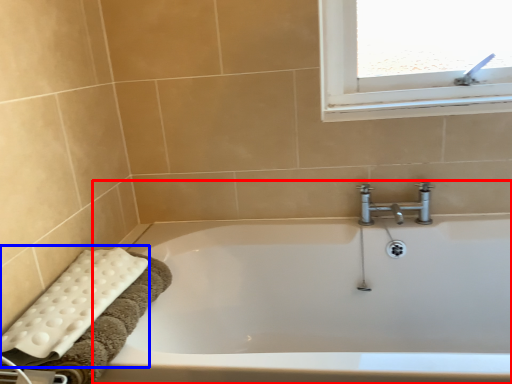
Question: Which object is closer to the camera taking this photo, bathtub (highlighted by a red box) or bath towel (highlighted by a blue box)?

Choices:
 (A) bathtub
 (B) bath towel

Answer: (A)